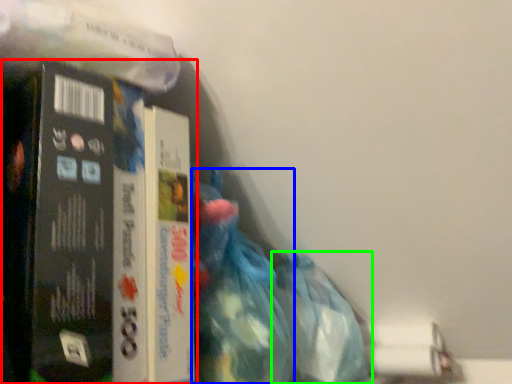
Question: Which object is the farthest from book (highlighted by a red box)? Choose among these: waste (highlighted by a blue box) or plastic bag (highlighted by a green box).

Choices:
 (A) waste
 (B) plastic bag

Answer: (B)